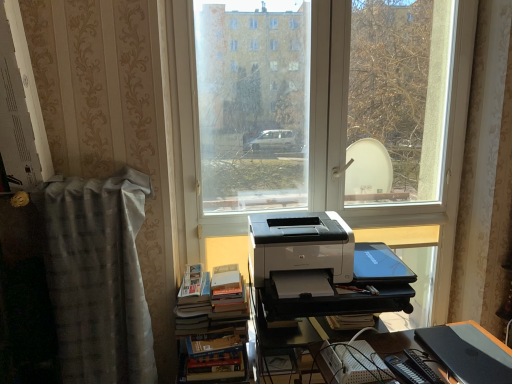
The width and height of the screenshot is (512, 384). In order to click on hardcover books at center-left in this screenshot , I will do `click(212, 337)`.

Measure the distance between point (x=96, y=306) and camera.

Point (x=96, y=306) is 5.42 feet from camera.

The height and width of the screenshot is (384, 512). What do you see at coordinates (323, 267) in the screenshot? I see `white glossy printer at center` at bounding box center [323, 267].

In the scene shown: Measure the distance between white glossy printer at center and camera.

white glossy printer at center and camera are 1.60 meters apart from each other.

The width and height of the screenshot is (512, 384). Identify the location of hardcover book at lower center. (355, 362).

Is hardcover books at center-left taller or shorter than white glossy printer at center?

Clearly, hardcover books at center-left is taller compared to white glossy printer at center.

Is hardcover books at center-left outside of white glossy printer at center?

Yes.

Considering the positions of objects hardcover books at center-left and white glossy printer at center in the image provided, who is in front, hardcover books at center-left or white glossy printer at center?

white glossy printer at center.

In the scene shown: Can you confirm if hardcover books at center-left is wider than white glossy printer at center?

Yes.

From the image's perspective, is black plastic register at lower right, which is counted as the 1th register, starting from the bottom, located beneath hardcover book at lower center?

Yes, from the image's perspective, black plastic register at lower right, which is counted as the 1th register, starting from the bottom, is below hardcover book at lower center.

Based on the photo, which point is more forward, (457,327) or (353,359)?

The point (353,359) is in front.

Considering the relative sizes of black plastic register at lower right, which is counted as the 1th register, starting from the bottom, and hardcover book at lower center in the image provided, is black plastic register at lower right, which is counted as the 1th register, starting from the bottom, bigger than hardcover book at lower center?

Correct, black plastic register at lower right, which is counted as the 1th register, starting from the bottom, is larger in size than hardcover book at lower center.

Locate an element on the screen. register lying in front of the hardcover book at lower center is located at coordinates (467, 354).

Looking at this image, can you tell me how much hardcover book at lower center and gray textured curtain at left differ in facing direction?

The angular difference between hardcover book at lower center and gray textured curtain at left is 86.4 degrees.

Is hardcover book at lower center inside or outside of gray textured curtain at left?

hardcover book at lower center lies outside gray textured curtain at left.

Which of these two, hardcover book at lower center or gray textured curtain at left, is bigger?

gray textured curtain at left.

Which object is positioned more to the left, hardcover book at lower center or gray textured curtain at left?

Positioned to the left is gray textured curtain at left.

Based on their positions, is gray textured curtain at left located to the left or right of hardcover books at center-left?

Based on their positions, gray textured curtain at left is located to the left of hardcover books at center-left.

From the image's perspective, does gray textured curtain at left appear higher than hardcover books at center-left?

Yes, from the image's perspective, gray textured curtain at left is over hardcover books at center-left.

Is gray textured curtain at left turned away from hardcover books at center-left?

No.

Which of these two, blue plastic laptop at center, which is the first register from left to right, or black plastic register at lower right, positioned as the first register in front-to-back order, is wider?

Wider between the two is blue plastic laptop at center, which is the first register from left to right.

Identify the location of register above the black plastic register at lower right, the second register positioned from the left (from a real-world perspective). (379, 265).

From a real-world perspective, which object stands above the other?

blue plastic laptop at center, marked as the second register in a front-to-back arrangement, is physically above.

Could you measure the distance between blue plastic laptop at center, the second register from the bottom, and hardcover book at lower center?

blue plastic laptop at center, the second register from the bottom, is 14.10 inches from hardcover book at lower center.

From the image's perspective, is blue plastic laptop at center, marked as the second register in a front-to-back arrangement, located above hardcover book at lower center?

Yes, from the image's perspective, blue plastic laptop at center, marked as the second register in a front-to-back arrangement, is over hardcover book at lower center.

What's the angular difference between blue plastic laptop at center, marked as the second register in a front-to-back arrangement, and hardcover book at lower center's facing directions?

The angle between the facing direction of blue plastic laptop at center, marked as the second register in a front-to-back arrangement, and the facing direction of hardcover book at lower center is 81.9 degrees.

Is blue plastic laptop at center, the second register from the bottom, to the left of hardcover book at lower center from the viewer's perspective?

Incorrect, blue plastic laptop at center, the second register from the bottom, is not on the left side of hardcover book at lower center.

Is hardcover book at lower center looking in the opposite direction of white plastic printer at center?

No, hardcover book at lower center is not facing away from white plastic printer at center.

Between hardcover book at lower center and white plastic printer at center, which one is positioned behind?

white plastic printer at center is further away from the camera.

Is hardcover book at lower center wider than white plastic printer at center?

Incorrect, the width of hardcover book at lower center does not surpass that of white plastic printer at center.

Based on the photo, do you think hardcover book at lower center is within white plastic printer at center, or outside of it?

hardcover book at lower center is not enclosed by white plastic printer at center.

Where is `book on the left side of white glossy printer at center`? This screenshot has height=384, width=512. book on the left side of white glossy printer at center is located at coordinates (212, 337).

Identify the location of register located in front of the hardcover book at lower center. (467, 354).

When comparing their distances from white plastic printer at center, does blue plastic laptop at center, marked as the second register in a front-to-back arrangement, or gray textured curtain at left seem further?

gray textured curtain at left is further to white plastic printer at center.

When comparing their distances from hardcover book at lower center, does hardcover books at center-left or white glossy printer at center seem closer?

Based on the image, white glossy printer at center appears to be nearer to hardcover book at lower center.

Based on their spatial positions, is white glossy printer at center or blue plastic laptop at center, which ranks as the 2th register in right-to-left order, further from black plastic register at lower right, positioned as the first register in front-to-back order?

white glossy printer at center.

Estimate the real-world distances between objects in this image. Which object is further from hardcover books at center-left, white glossy printer at center or white plastic printer at center?

white glossy printer at center is further to hardcover books at center-left.

From the image, which object appears to be nearer to blue plastic laptop at center, the second register from the bottom, hardcover books at center-left or white plastic printer at center?

white plastic printer at center.

When comparing their distances from blue plastic laptop at center, marked as the second register in a front-to-back arrangement, does hardcover books at center-left or white glossy printer at center seem further?

hardcover books at center-left.

Considering their positions, is white glossy printer at center positioned closer to black plastic register at lower right, the second register when ordered from back to front, than gray textured curtain at left?

white glossy printer at center is positioned closer to the anchor black plastic register at lower right, the second register when ordered from back to front.

Considering their positions, is hardcover book at lower center positioned further to white plastic printer at center than white glossy printer at center?

hardcover book at lower center.

The image size is (512, 384). In order to click on printer between hardcover books at center-left and hardcover book at lower center from left to right in this screenshot , I will do `click(323, 267)`.

Locate an element on the screen. The image size is (512, 384). printer between hardcover books at center-left and black plastic register at lower right, the second register positioned from the top, from left to right is located at coordinates point(323,267).

Image resolution: width=512 pixels, height=384 pixels. In order to click on printer between gray textured curtain at left and hardcover book at lower center in the horizontal direction in this screenshot , I will do pos(323,267).

Where is `register between white plastic printer at center and black plastic register at lower right, positioned as the first register in front-to-back order`? This screenshot has width=512, height=384. register between white plastic printer at center and black plastic register at lower right, positioned as the first register in front-to-back order is located at coordinates (379, 265).